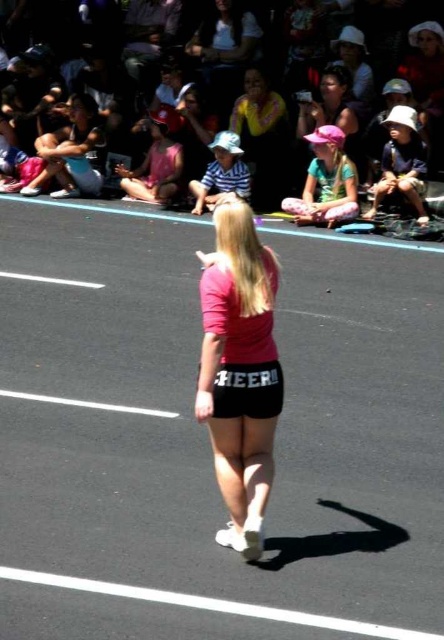
You are a photographer at the event and need to capture a photo that includes both the matte pink shorts at center and the light blue denim shorts at lower left. Which pair of shorts will appear smaller in the final photo?

The matte pink shorts at center will appear smaller in the final photo because they have a lesser height compared to the light blue denim shorts at lower left.

You are standing at the point labeled point (67, 189) in the image. You want to walk to the point labeled point (248, 125). Which direction should you move relative to your current position?

You should move backward because point (248, 125) is behind point (67, 189).